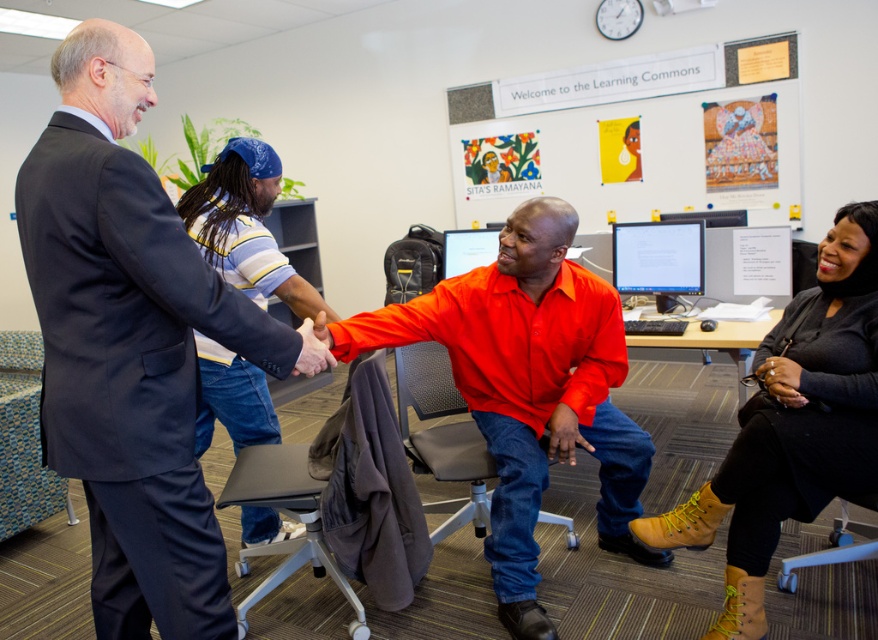
You are a visitor in the Learning Commons and want to greet the person in the dark blue suit at left. Which direction should you walk to approach them from the black knit sweater at lower right?

To approach the dark blue suit at left from the black knit sweater at lower right, you should walk to the left since the dark blue suit at left is positioned to the left of the black knit sweater at lower right.

You are a student who just entered the Learning Commons and want to sit down to study. There is a black knit sweater at lower right and a matte black monitor at center. Which object should you move to access the seat?

The black knit sweater at lower right is below the matte black monitor at center, so you should move the black knit sweater at lower right to access the seat.

Based on the coordinates provided, which object is located at point (131,346)?

The point (131,346) corresponds to the dark blue suit at left.